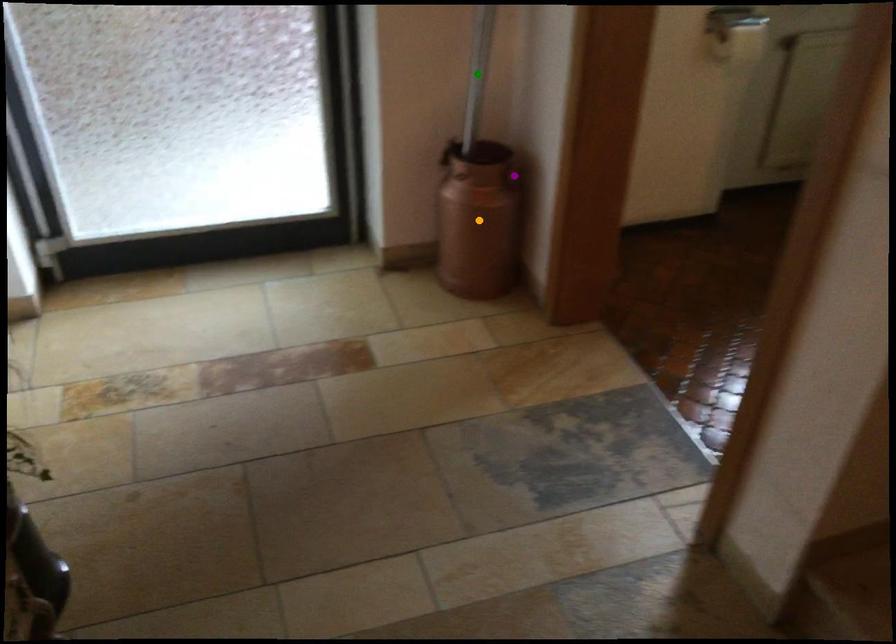
Order these from farthest to nearest:
purple point, green point, orange point

purple point, orange point, green point